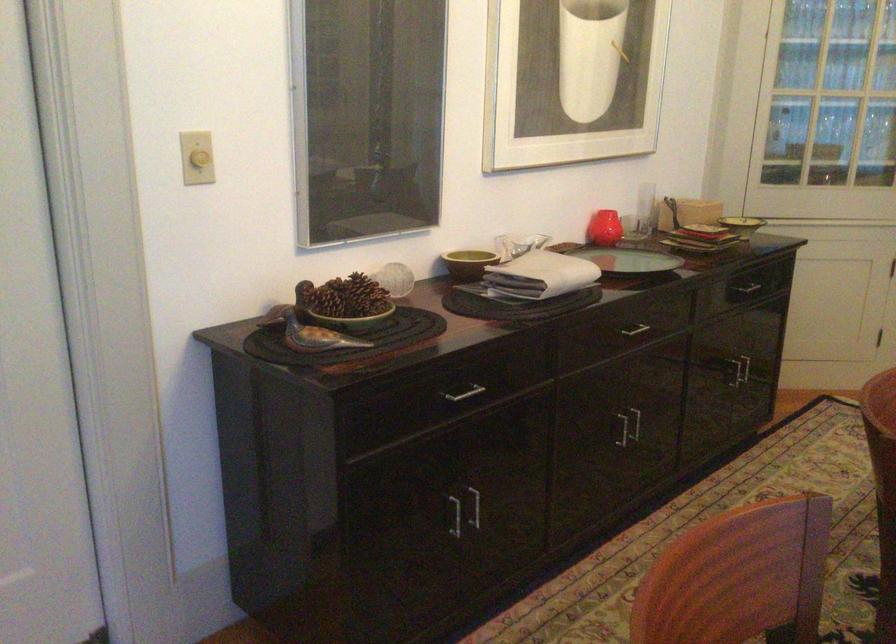
Which object does [604,228] point to?

It corresponds to the red glass vase in the image.